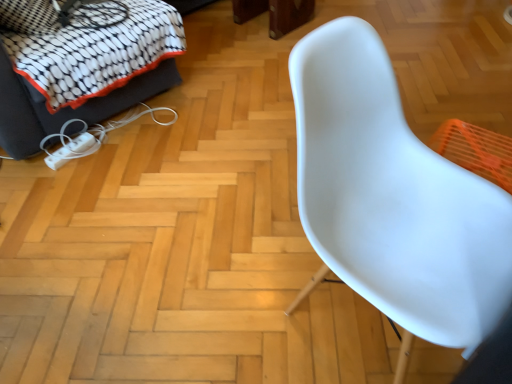
Question: Considering the relative sizes of white plastic chair at right and white fabric sofa at upper left in the image provided, is white plastic chair at right bigger than white fabric sofa at upper left?

Choices:
 (A) no
 (B) yes

Answer: (A)

Question: Is white plastic chair at right far from white fabric sofa at upper left?

Choices:
 (A) no
 (B) yes

Answer: (B)

Question: From the image's perspective, would you say white plastic chair at right is shown under white fabric sofa at upper left?

Choices:
 (A) no
 (B) yes

Answer: (B)

Question: Is white fabric sofa at upper left surrounded by white plastic chair at right?

Choices:
 (A) yes
 (B) no

Answer: (B)

Question: Is white plastic chair at right aimed at white fabric sofa at upper left?

Choices:
 (A) no
 (B) yes

Answer: (A)

Question: From a real-world perspective, is white plastic chair at right physically below white fabric sofa at upper left?

Choices:
 (A) yes
 (B) no

Answer: (B)

Question: Does white fabric sofa at upper left have a larger size compared to white plastic chair at right?

Choices:
 (A) no
 (B) yes

Answer: (B)

Question: From a real-world perspective, is white fabric sofa at upper left over white plastic chair at right?

Choices:
 (A) no
 (B) yes

Answer: (A)

Question: Is white fabric sofa at upper left not near white plastic chair at right?

Choices:
 (A) no
 (B) yes

Answer: (B)

Question: Is white fabric sofa at upper left facing away from white plastic chair at right?

Choices:
 (A) no
 (B) yes

Answer: (A)

Question: Considering the relative positions of white fabric sofa at upper left and white plastic chair at right in the image provided, is white fabric sofa at upper left to the left of white plastic chair at right from the viewer's perspective?

Choices:
 (A) no
 (B) yes

Answer: (B)

Question: From a real-world perspective, is white fabric sofa at upper left under white plastic chair at right?

Choices:
 (A) yes
 (B) no

Answer: (A)

Question: Is point (28, 34) closer or farther from the camera than point (342, 221)?

Choices:
 (A) closer
 (B) farther

Answer: (B)